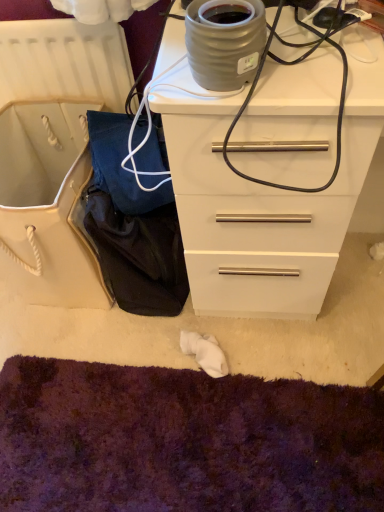
Question: Should I look upward or downward to see white glossy chest of drawers at upper right?

Choices:
 (A) down
 (B) up

Answer: (B)

Question: Would you say white glossy chest of drawers at upper right is a long distance from matte gray ceramic pot at upper center?

Choices:
 (A) yes
 (B) no

Answer: (B)

Question: Can you confirm if white glossy chest of drawers at upper right is smaller than matte gray ceramic pot at upper center?

Choices:
 (A) no
 (B) yes

Answer: (A)

Question: Can you confirm if white glossy chest of drawers at upper right is bigger than matte gray ceramic pot at upper center?

Choices:
 (A) no
 (B) yes

Answer: (B)

Question: Is white glossy chest of drawers at upper right at the right side of matte gray ceramic pot at upper center?

Choices:
 (A) yes
 (B) no

Answer: (A)

Question: From a real-world perspective, does white glossy chest of drawers at upper right sit lower than matte gray ceramic pot at upper center?

Choices:
 (A) no
 (B) yes

Answer: (B)

Question: Is white glossy chest of drawers at upper right wider than matte gray ceramic pot at upper center?

Choices:
 (A) yes
 (B) no

Answer: (A)

Question: Does white glossy chest of drawers at upper right lie behind purple shaggy carpet at lower center?

Choices:
 (A) yes
 (B) no

Answer: (B)

Question: Are white glossy chest of drawers at upper right and purple shaggy carpet at lower center far apart?

Choices:
 (A) no
 (B) yes

Answer: (A)

Question: Is white glossy chest of drawers at upper right shorter than purple shaggy carpet at lower center?

Choices:
 (A) yes
 (B) no

Answer: (B)

Question: Does white glossy chest of drawers at upper right have a smaller size compared to purple shaggy carpet at lower center?

Choices:
 (A) yes
 (B) no

Answer: (B)

Question: Considering the relative sizes of white glossy chest of drawers at upper right and purple shaggy carpet at lower center in the image provided, is white glossy chest of drawers at upper right thinner than purple shaggy carpet at lower center?

Choices:
 (A) no
 (B) yes

Answer: (B)

Question: Considering the relative sizes of white glossy chest of drawers at upper right and purple shaggy carpet at lower center in the image provided, is white glossy chest of drawers at upper right wider than purple shaggy carpet at lower center?

Choices:
 (A) no
 (B) yes

Answer: (A)

Question: Is matte gray ceramic pot at upper center wider than white glossy chest of drawers at upper right?

Choices:
 (A) yes
 (B) no

Answer: (B)